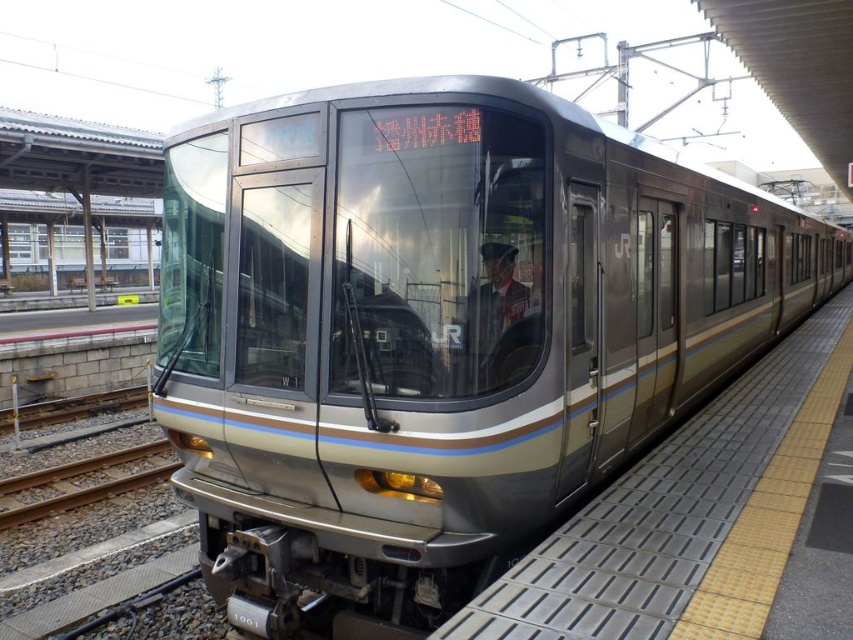
Does metallic gray platform at center appear on the left side of uniformed person at center?

No, metallic gray platform at center is not to the left of uniformed person at center.

Which is in front, point (799, 465) or point (489, 280)?

Positioned in front is point (489, 280).

Between point (780, 435) and point (498, 296), which one is positioned behind?

Positioned behind is point (780, 435).

Locate an element on the screen. metallic gray platform at center is located at coordinates (688, 515).

This screenshot has height=640, width=853. What do you see at coordinates (437, 332) in the screenshot?
I see `metallic silver train at center` at bounding box center [437, 332].

Is point (372, 163) positioned after point (490, 340)?

Yes, it is.

Identify the location of metallic silver train at center. The width and height of the screenshot is (853, 640). (437, 332).

Looking at this image, does metallic silver train at center have a greater height compared to metallic gray platform at center?

Yes.

Does point (259, 634) come closer to viewer compared to point (614, 508)?

Yes, it is in front of point (614, 508).

Locate an element on the screen. metallic silver train at center is located at coordinates (437, 332).